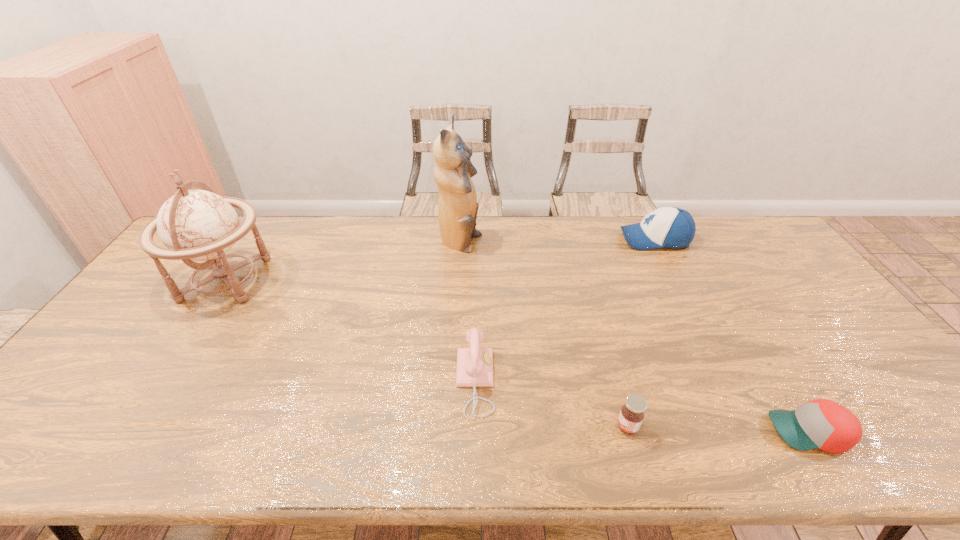
Identify the location of free location located at the brim of the shortest object. Image resolution: width=960 pixels, height=540 pixels. (633, 431).

Find the location of a particular element. The image size is (960, 540). cat located at the far edge is located at coordinates [457, 207].

The height and width of the screenshot is (540, 960). Find the location of `globe that is at the far edge`. globe that is at the far edge is located at coordinates (199, 225).

Locate an element on the screen. baseball cap present at the far edge is located at coordinates (670, 227).

At what (x,y) coordinates should I click in order to perform the action: click on jam present at the near edge. Please return your answer as a coordinate pair (x, y). The height and width of the screenshot is (540, 960). Looking at the image, I should click on (631, 415).

What are the coordinates of `baseball cap present at the near edge` in the screenshot? It's located at (822, 424).

At what (x,y) coordinates should I click in order to perform the action: click on object present at the left edge. Please return your answer as a coordinate pair (x, y). This screenshot has width=960, height=540. Looking at the image, I should click on (199, 225).

You are a GUI agent. You are given a task and a screenshot of the screen. Output one action in this format:
    pyautogui.click(x=<x>, y=<y>)
    Task: Click on the object that is at the far left corner
    
    Given the screenshot: What is the action you would take?
    pyautogui.click(x=199, y=225)

Where is `vacant point at the far edge`? vacant point at the far edge is located at coordinates (414, 225).

In the image, there is a desktop. Where is `vacant space at the near edge`? The height and width of the screenshot is (540, 960). vacant space at the near edge is located at coordinates (564, 454).